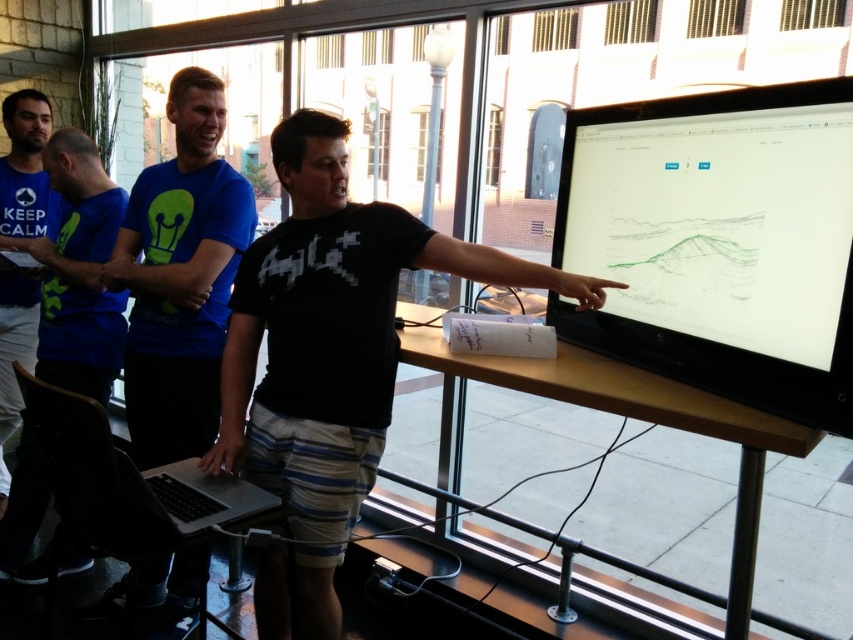
Who is more forward, [132,292] or [47,371]?

Point [132,292] is in front.

Who is positioned more to the left, blue matte shirt at center or blue fabric shirt at left?

blue fabric shirt at left

Find the location of a particular element. blue matte shirt at center is located at coordinates (180, 276).

You are a GUI agent. You are given a task and a screenshot of the screen. Output one action in this format:
    pyautogui.click(x=<x>, y=<y>)
    Task: Click on the blue matte shirt at center
    The image size is (853, 640).
    Given the screenshot: What is the action you would take?
    pyautogui.click(x=180, y=276)

Can you confirm if matte black monitor at right is shorter than blue fabric shirt at left?

Correct, matte black monitor at right is not as tall as blue fabric shirt at left.

Looking at this image, between matte black monitor at right and blue fabric shirt at left, which one has less height?

Standing shorter between the two is matte black monitor at right.

Describe the element at coordinates (718, 241) in the screenshot. I see `matte black monitor at right` at that location.

What are the coordinates of `matte black monitor at right` in the screenshot? It's located at (718, 241).

Measure the distance between blue t-shirt at left and silver metallic laptop at lower left.

blue t-shirt at left and silver metallic laptop at lower left are 5.05 feet apart.

Measure the distance between blue t-shirt at left and silver metallic laptop at lower left.

blue t-shirt at left and silver metallic laptop at lower left are 5.05 feet apart from each other.

Is point (12, 328) positioned after point (196, 525)?

Yes, point (12, 328) is behind point (196, 525).

You are a GUI agent. You are given a task and a screenshot of the screen. Output one action in this format:
    pyautogui.click(x=<x>, y=<y>)
    Task: Click on the blue t-shirt at left
    The image size is (853, 640).
    Given the screenshot: What is the action you would take?
    pyautogui.click(x=25, y=164)